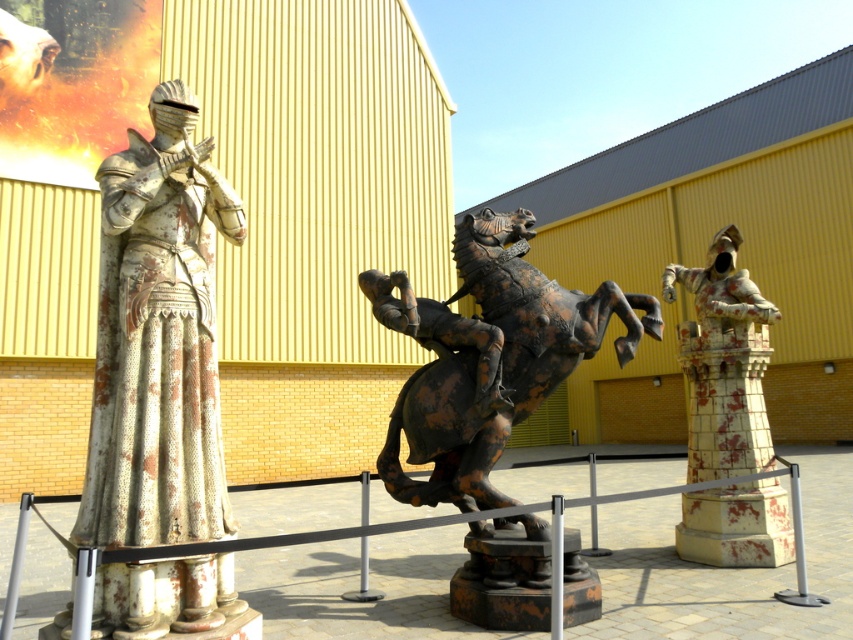
In the scene shown: Between rusty metal knight at left and white tiled tower at right, which one has less height?

rusty metal knight at left

Is rusty metal knight at left taller than white tiled tower at right?

In fact, rusty metal knight at left may be shorter than white tiled tower at right.

Between point (196, 416) and point (775, 563), which one is positioned in front?

Point (196, 416)

Where is `rusty metal knight at left`? Image resolution: width=853 pixels, height=640 pixels. rusty metal knight at left is located at coordinates click(158, 339).

Which of these two, rusty metal barrier at center or white tiled tower at right, stands shorter?

With less height is rusty metal barrier at center.

Is point (647, 596) less distant than point (692, 392)?

Yes.

Who is more forward, (300, 586) or (695, 476)?

Point (300, 586) is more forward.

Where is `rusty metal barrier at center`? The image size is (853, 640). rusty metal barrier at center is located at coordinates (357, 586).

Is rusty metal knight at left in front of rusty metal horse at center?

Yes, it is.

Is point (120, 493) less distant than point (467, 346)?

Yes.

I want to click on rusty metal knight at left, so click(158, 339).